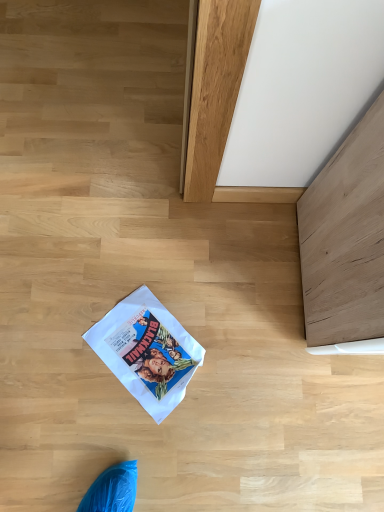
Where is `vacant space that is to the left of white paper at center`? The height and width of the screenshot is (512, 384). vacant space that is to the left of white paper at center is located at coordinates (62, 334).